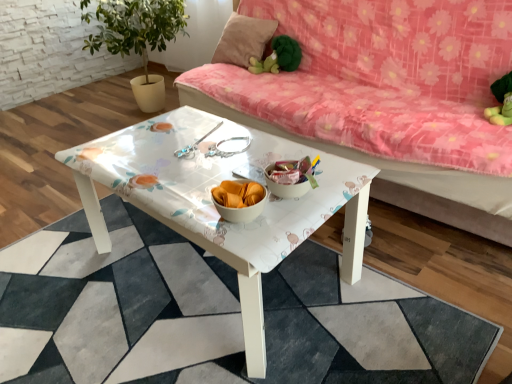
This screenshot has height=384, width=512. What do you see at coordinates (213, 205) in the screenshot?
I see `white glossy coffee table at center` at bounding box center [213, 205].

Measure the distance between point (251,250) and camera.

Point (251,250) and camera are 1.00 meters apart from each other.

Locate an element on the screen. pink fabric pillow at upper center is located at coordinates (243, 39).

This screenshot has width=512, height=384. I want to click on white glossy table at center, so click(122, 308).

How many degrees apart are the facing directions of white glossy coffee table at center and green plush toy at upper center?

The angular difference between white glossy coffee table at center and green plush toy at upper center is 94.3 degrees.

Could you tell me if white glossy coffee table at center is facing green plush toy at upper center?

No, white glossy coffee table at center does not turn towards green plush toy at upper center.

Identify the location of coffee table below the green plush toy at upper center (from the image's perspective). This screenshot has height=384, width=512. (213, 205).

From the image's perspective, which is above, white glossy coffee table at center or green plush toy at upper center?

From the image's view, green plush toy at upper center is above.

Is pink fabric pillow at upper center positioned with its back to green plush toy at upper center?

No.

Which point is more forward, (241, 27) or (257, 64)?

Positioned in front is point (257, 64).

Is pink fabric pillow at upper center directly adjacent to green plush toy at upper center?

No, pink fabric pillow at upper center is not with green plush toy at upper center.

Is pink fabric pillow at upper center outside of green plush toy at upper center?

pink fabric pillow at upper center is positioned outside green plush toy at upper center.

In the image, is green plush toy at upper center on the left side or the right side of white glossy table at center?

green plush toy at upper center is positioned on white glossy table at center's right side.

Considering the sizes of objects green plush toy at upper center and white glossy table at center in the image provided, who is taller, green plush toy at upper center or white glossy table at center?

Standing taller between the two is green plush toy at upper center.

Is green plush toy at upper center wider or thinner than white glossy table at center?

Clearly, green plush toy at upper center has less width compared to white glossy table at center.

Is green plush toy at upper center not near white glossy table at center?

That's right, there is a large distance between green plush toy at upper center and white glossy table at center.

In terms of size, does white glossy table at center appear bigger or smaller than pink fabric pillow at upper center?

In the image, white glossy table at center appears to be larger than pink fabric pillow at upper center.

Is pink fabric pillow at upper center at the back of white glossy table at center?

No, white glossy table at center's orientation is not away from pink fabric pillow at upper center.

Is white glossy table at center in front of or behind pink fabric pillow at upper center in the image?

white glossy table at center is positioned closer to the viewer than pink fabric pillow at upper center.

Is pink fabric pillow at upper center not near white glossy table at center?

Yes, pink fabric pillow at upper center is far from white glossy table at center.

Do you think pink fabric pillow at upper center is within white glossy table at center, or outside of it?

pink fabric pillow at upper center is not enclosed by white glossy table at center.

From a real-world perspective, who is located lower, pink fabric pillow at upper center or white glossy table at center?

In real-world perspective, white glossy table at center is lower.

Considering the relative sizes of pink fabric pillow at upper center and white glossy table at center in the image provided, is pink fabric pillow at upper center shorter than white glossy table at center?

In fact, pink fabric pillow at upper center may be taller than white glossy table at center.

In terms of size, does green plush toy at upper center appear bigger or smaller than pink fabric pillow at upper center?

In the image, green plush toy at upper center appears to be smaller than pink fabric pillow at upper center.

From a real-world perspective, is green plush toy at upper center physically below pink fabric pillow at upper center?

Indeed, from a real-world perspective, green plush toy at upper center is positioned beneath pink fabric pillow at upper center.

Consider the image. Is green plush toy at upper center not near pink fabric pillow at upper center?

That's not correct — green plush toy at upper center is a little close to pink fabric pillow at upper center.

Can you tell me how much green plush toy at upper center and pink fabric pillow at upper center differ in facing direction?

4.35 degrees separate the facing orientations of green plush toy at upper center and pink fabric pillow at upper center.

Looking at this image, is white glossy coffee table at center turned away from floral fabric couch at upper center?

That's not correct — white glossy coffee table at center is not looking away from floral fabric couch at upper center.

The width and height of the screenshot is (512, 384). Identify the location of studio couch above the white glossy coffee table at center (from a real-world perspective). (387, 99).

From a real-world perspective, is white glossy coffee table at center physically above floral fabric couch at upper center?

Actually, white glossy coffee table at center is physically below floral fabric couch at upper center in the real world.

Which is correct: white glossy coffee table at center is inside floral fabric couch at upper center, or outside of it?

white glossy coffee table at center lies outside floral fabric couch at upper center.

Image resolution: width=512 pixels, height=384 pixels. I want to click on coffee table below the green plush toy at upper center (from the image's perspective), so click(213, 205).

I want to click on toy that appears on the right of pink fabric pillow at upper center, so 278,57.

Considering their positions, is green plush toy at upper center positioned closer to white glossy table at center than white glossy coffee table at center?

white glossy coffee table at center.

Considering their positions, is white glossy coffee table at center positioned further to green plush toy at upper center than white glossy table at center?

Based on the image, white glossy table at center appears to be further to green plush toy at upper center.

Estimate the real-world distances between objects in this image. Which object is closer to pink fabric pillow at upper center, floral fabric couch at upper center or white glossy coffee table at center?

floral fabric couch at upper center lies closer to pink fabric pillow at upper center than the other object.

Looking at the image, which one is located further to floral fabric couch at upper center, white glossy coffee table at center or green plush toy at upper center?

white glossy coffee table at center lies further to floral fabric couch at upper center than the other object.

Considering their positions, is white glossy table at center positioned further to white glossy coffee table at center than green plush toy at upper center?

The object further to white glossy coffee table at center is green plush toy at upper center.

Considering their positions, is pink fabric pillow at upper center positioned closer to white glossy table at center than white glossy coffee table at center?

The object closer to white glossy table at center is white glossy coffee table at center.

Estimate the real-world distances between objects in this image. Which object is closer to pink fabric pillow at upper center, floral fabric couch at upper center or green plush toy at upper center?

green plush toy at upper center is positioned closer to the anchor pink fabric pillow at upper center.

When comparing their distances from floral fabric couch at upper center, does white glossy coffee table at center or white glossy table at center seem closer?

white glossy coffee table at center.

In order to click on coffee table positioned between white glossy table at center and pink fabric pillow at upper center from near to far in this screenshot , I will do `click(213, 205)`.

Locate an element on the screen. studio couch positioned between white glossy coffee table at center and pink fabric pillow at upper center from near to far is located at coordinates (387, 99).

The height and width of the screenshot is (384, 512). Find the location of `coffee table between floral fabric couch at upper center and white glossy table at center from top to bottom`. coffee table between floral fabric couch at upper center and white glossy table at center from top to bottom is located at coordinates [213, 205].

Where is `studio couch between white glossy table at center and pink fabric pillow at upper center in the front-back direction`? The image size is (512, 384). studio couch between white glossy table at center and pink fabric pillow at upper center in the front-back direction is located at coordinates (387, 99).